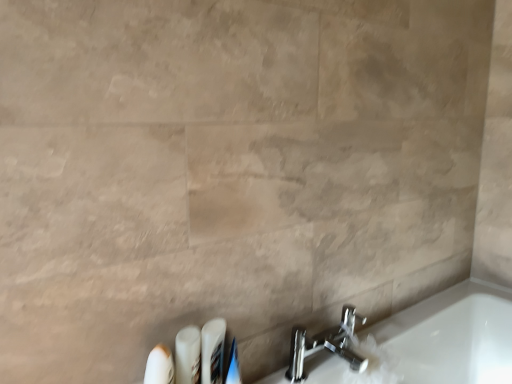
Question: Is white plastic toothbrushes at lower center, the third toiletry positioned from the left, surrounding white glossy tube at lower center, the third toiletry positioned from the right?

Choices:
 (A) no
 (B) yes

Answer: (A)

Question: Considering the relative sizes of white plastic toothbrushes at lower center, the third toiletry positioned from the left, and white glossy tube at lower center, the third toiletry positioned from the right, in the image provided, is white plastic toothbrushes at lower center, the third toiletry positioned from the left, shorter than white glossy tube at lower center, the third toiletry positioned from the right,?

Choices:
 (A) yes
 (B) no

Answer: (A)

Question: Is white plastic toothbrushes at lower center, the third toiletry positioned from the left, located outside white glossy tube at lower center, the 2th toiletry when ordered from left to right?

Choices:
 (A) yes
 (B) no

Answer: (A)

Question: Considering the relative positions of white plastic toothbrushes at lower center, the third toiletry positioned from the left, and white glossy tube at lower center, the 2th toiletry when ordered from left to right, in the image provided, is white plastic toothbrushes at lower center, the third toiletry positioned from the left, to the right of white glossy tube at lower center, the 2th toiletry when ordered from left to right, from the viewer's perspective?

Choices:
 (A) yes
 (B) no

Answer: (A)

Question: Is white plastic toothbrushes at lower center, the third toiletry positioned from the left, in front of white glossy tube at lower center, the 2th toiletry when ordered from left to right?

Choices:
 (A) no
 (B) yes

Answer: (A)

Question: Considering the relative sizes of white plastic toothbrushes at lower center, the third toiletry positioned from the left, and white glossy tube at lower center, the third toiletry positioned from the right, in the image provided, is white plastic toothbrushes at lower center, the third toiletry positioned from the left, smaller than white glossy tube at lower center, the third toiletry positioned from the right,?

Choices:
 (A) no
 (B) yes

Answer: (A)

Question: Is white glossy tube at lower center, the 2th toiletry when ordered from left to right, taller than polished chrome faucet at lower right?

Choices:
 (A) no
 (B) yes

Answer: (B)

Question: Is white glossy tube at lower center, the 2th toiletry when ordered from left to right, to the right of polished chrome faucet at lower right from the viewer's perspective?

Choices:
 (A) yes
 (B) no

Answer: (B)

Question: Is the depth of white glossy tube at lower center, the 2th toiletry when ordered from left to right, greater than that of polished chrome faucet at lower right?

Choices:
 (A) no
 (B) yes

Answer: (A)

Question: Is white glossy tube at lower center, the third toiletry positioned from the right, far from polished chrome faucet at lower right?

Choices:
 (A) yes
 (B) no

Answer: (B)

Question: Is the position of white glossy tube at lower center, the third toiletry positioned from the right, less distant than that of polished chrome faucet at lower right?

Choices:
 (A) no
 (B) yes

Answer: (B)

Question: From the image's perspective, does white glossy tube at lower center, the 2th toiletry when ordered from left to right, appear lower than polished chrome faucet at lower right?

Choices:
 (A) yes
 (B) no

Answer: (B)

Question: Would you say polished chrome faucet at lower right is a long distance from white plastic toothbrush at lower left, the first toiletry from the left?

Choices:
 (A) no
 (B) yes

Answer: (A)